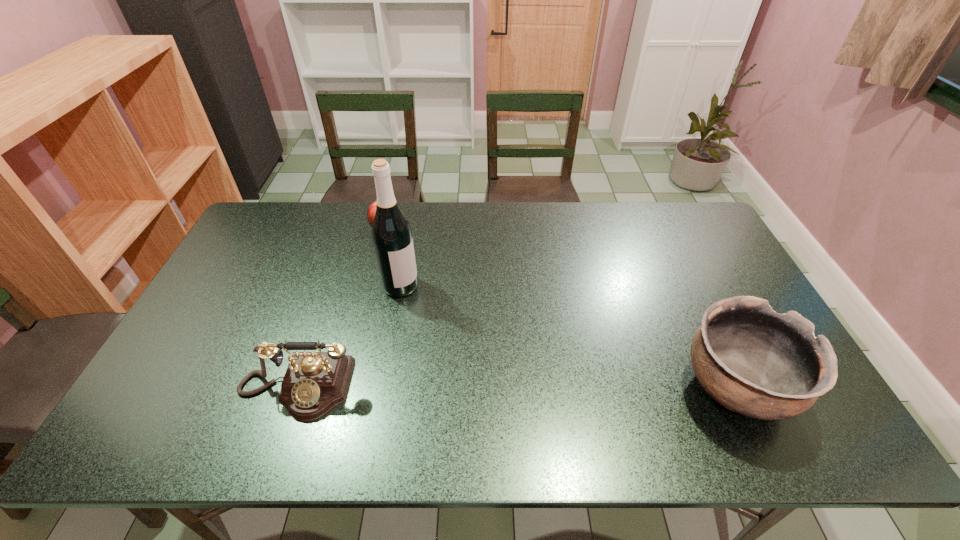
You are a GUI agent. You are given a task and a screenshot of the screen. Output one action in this format:
    pyautogui.click(x=<x>, y=<y>)
    Task: Click on the free space located on the bitten side of the shortest object
    The width and height of the screenshot is (960, 540).
    Given the screenshot: What is the action you would take?
    pyautogui.click(x=395, y=250)

Find the location of a particular element. blank area located 0.340m on the bitten side of the shortest object is located at coordinates (420, 307).

The height and width of the screenshot is (540, 960). Identify the location of vacant space located on the bitten side of the shortest object. tap(406, 275).

Where is `object that is at the far edge`? object that is at the far edge is located at coordinates (371, 211).

You are a GUI agent. You are given a task and a screenshot of the screen. Output one action in this format:
    pyautogui.click(x=<x>, y=<y>)
    Task: Click on the telephone at the near edge
    This screenshot has height=540, width=960.
    Given the screenshot: What is the action you would take?
    pyautogui.click(x=314, y=383)

Find the location of `pottery located at the near edge`. pottery located at the near edge is located at coordinates (753, 361).

This screenshot has width=960, height=540. I want to click on object situated at the right edge, so click(753, 361).

The image size is (960, 540). What are the coordinates of `object at the near right corner` in the screenshot? It's located at (753, 361).

In the image, there is a desktop. At what (x,y) coordinates should I click in order to perform the action: click on vacant area at the far edge. Please return your answer as a coordinate pair (x, y). The width and height of the screenshot is (960, 540). Looking at the image, I should click on (479, 222).

The image size is (960, 540). Find the location of `vacant space at the near edge`. vacant space at the near edge is located at coordinates (588, 399).